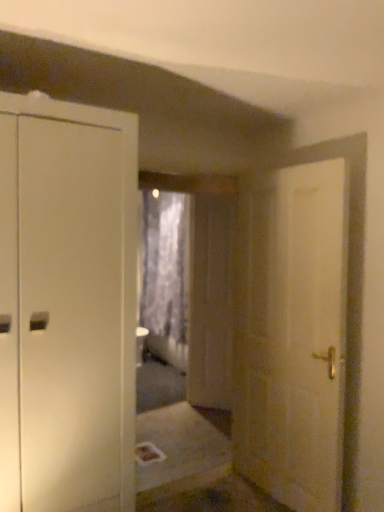
Question: Are transparent plastic screen door at center and white matte door at right making contact?

Choices:
 (A) yes
 (B) no

Answer: (B)

Question: Is transparent plastic screen door at center further to camera compared to white matte door at right?

Choices:
 (A) yes
 (B) no

Answer: (A)

Question: Would you say transparent plastic screen door at center is outside white matte door at right?

Choices:
 (A) yes
 (B) no

Answer: (A)

Question: Does transparent plastic screen door at center have a greater height compared to white matte door at right?

Choices:
 (A) no
 (B) yes

Answer: (B)

Question: Is there a large distance between transparent plastic screen door at center and white matte door at right?

Choices:
 (A) yes
 (B) no

Answer: (A)

Question: Is white matte door at right inside or outside of transparent plastic screen door at center?

Choices:
 (A) inside
 (B) outside

Answer: (B)

Question: From a real-world perspective, is white matte door at right above or below transparent plastic screen door at center?

Choices:
 (A) below
 (B) above

Answer: (B)

Question: Considering the positions of white matte door at right and transparent plastic screen door at center in the image, is white matte door at right bigger or smaller than transparent plastic screen door at center?

Choices:
 (A) big
 (B) small

Answer: (A)

Question: Looking at their shapes, would you say white matte door at right is wider or thinner than transparent plastic screen door at center?

Choices:
 (A) thin
 (B) wide

Answer: (B)

Question: In the image, is gray textured curtain at center positioned in front of or behind white matte door at right?

Choices:
 (A) front
 (B) behind

Answer: (B)

Question: From the image's perspective, relative to white matte door at right, is gray textured curtain at center above or below?

Choices:
 (A) above
 (B) below

Answer: (A)

Question: Is gray textured curtain at center inside or outside of white matte door at right?

Choices:
 (A) outside
 (B) inside

Answer: (A)

Question: Considering the positions of point (152, 214) and point (248, 376), is point (152, 214) closer or farther from the camera than point (248, 376)?

Choices:
 (A) closer
 (B) farther

Answer: (B)

Question: From a real-world perspective, relative to gray textured curtain at center, is transparent plastic screen door at center vertically above or below?

Choices:
 (A) below
 (B) above

Answer: (A)

Question: From the image's perspective, is transparent plastic screen door at center above or below gray textured curtain at center?

Choices:
 (A) above
 (B) below

Answer: (B)